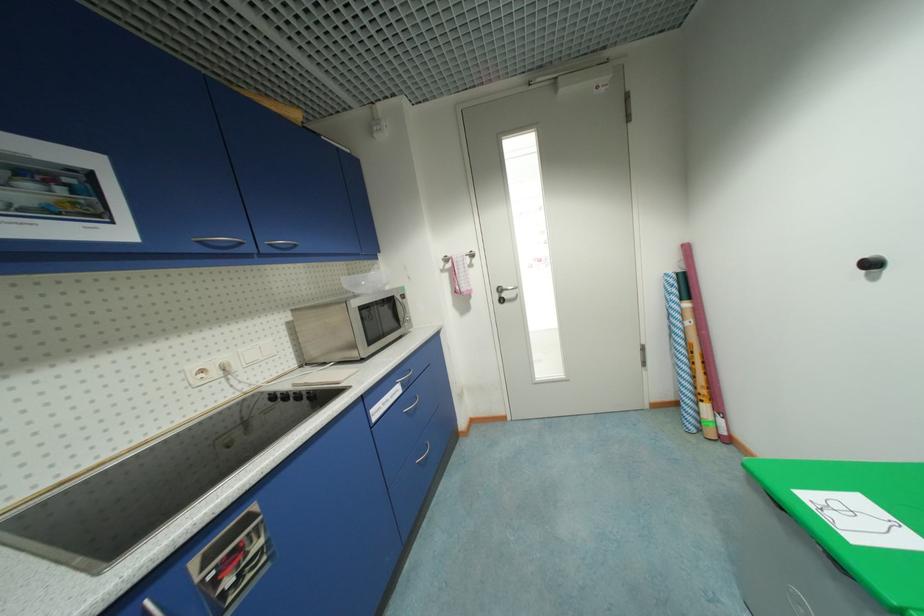
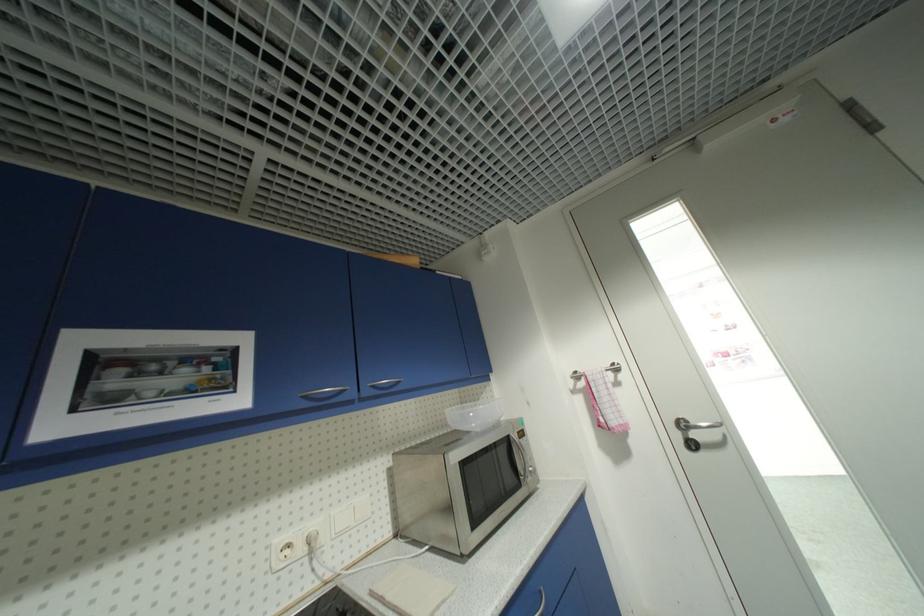
In the second image, find the point that corresponds to the point at 347,278 in the first image.

(454, 413)